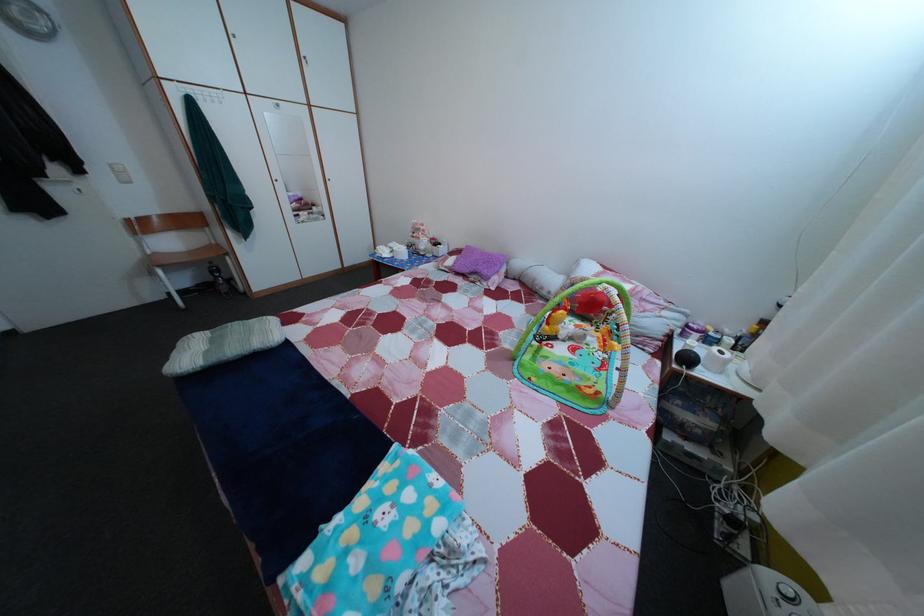
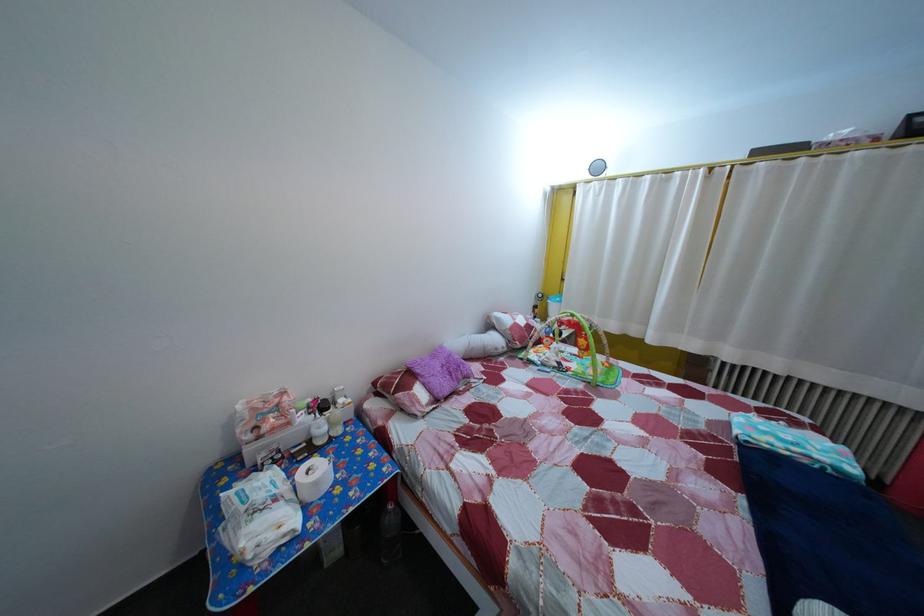
In the second image, find the point that corresponds to pixel 429 246 in the first image.

(298, 432)